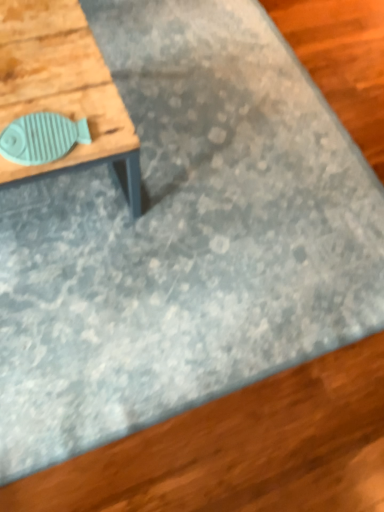
Question: Should I look upward or downward to see teal matte fish-shaped object at upper left?

Choices:
 (A) down
 (B) up

Answer: (B)